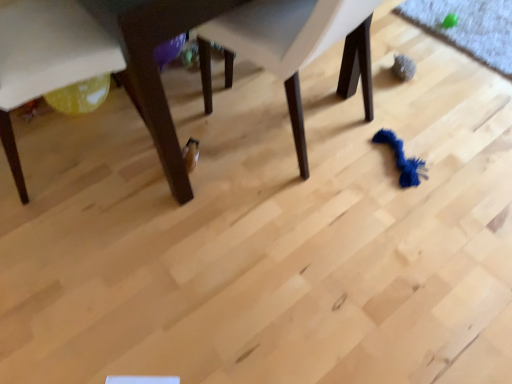
Question: From a real-world perspective, relative to white plastic chair at center, marked as the 2th chair in a left-to-right arrangement, is matte white chair at lower left, acting as the second chair starting from the right, vertically above or below?

Choices:
 (A) below
 (B) above

Answer: (A)

Question: Would you say matte white chair at lower left, acting as the second chair starting from the right, is inside or outside white plastic chair at center, positioned as the 1th chair in right-to-left order?

Choices:
 (A) outside
 (B) inside

Answer: (A)

Question: Estimate the real-world distances between objects in this image. Which object is closer to the matte white chair at lower left, placed as the first chair when sorted from left to right?

Choices:
 (A) white plastic chair at center, positioned as the 1th chair in right-to-left order
 (B) wooden table at center

Answer: (B)

Question: Considering the real-world distances, which object is farthest from the matte white chair at lower left, acting as the second chair starting from the right?

Choices:
 (A) white plastic chair at center, positioned as the 1th chair in right-to-left order
 (B) wooden table at center

Answer: (A)